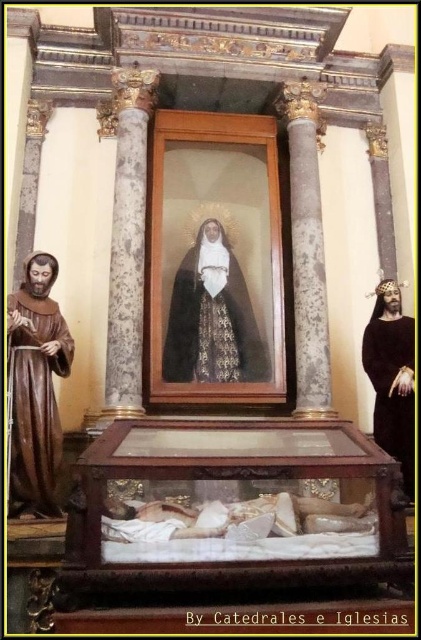
You are a caretaker of the altar and need to place a new candle holder. The wooden sarcophagus at center and the black velvet robe at center are already present. Which object should you place the candle holder next to if you want it to be near the larger object?

The wooden sarcophagus at center is bigger than the black velvet robe at center, so you should place the candle holder next to the wooden sarcophagus at center.

You are an altar caretaker who needs to ensure all items are within the designated space. The brown wooden statue at left and the black velvet robe at right must fit into a storage compartment that can only accommodate items narrower than the other. Which item should be placed first to ensure both fit?

The brown wooden statue at left has a lesser width compared to the black velvet robe at right, so place the brown wooden statue at left first, then the black velvet robe at right will fit as well.

You are standing in front of the religious altar and want to place a small candle between the two points marked as point (133,460) and point (242,356). According to the altar setup, where should you place the candle so it is closer to the point that is in front?

The point (133,460) is in front of point (242,356). Therefore, to place the candle closer to the point that is in front, you should position it near point (133,460).